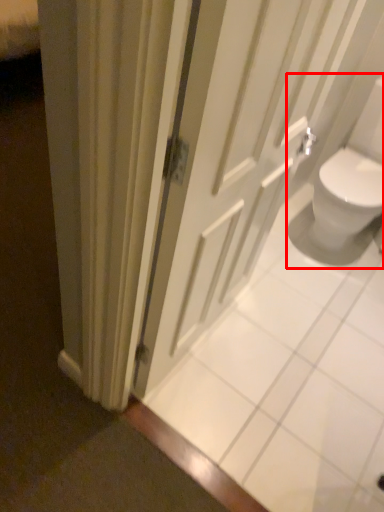
Question: From the image's perspective, considering the relative positions of sink (annotated by the red box) and door in the image provided, where is sink (annotated by the red box) located with respect to the staircase?

Choices:
 (A) below
 (B) above

Answer: (B)